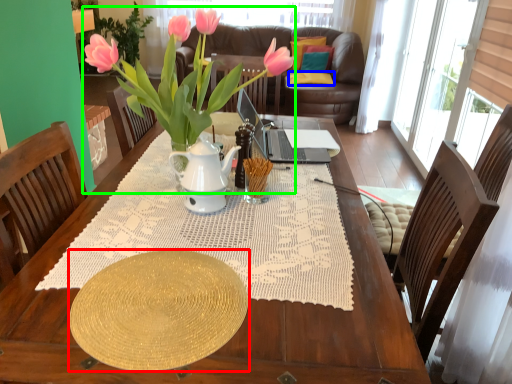
Question: Based on their relative distances, which object is farther from plate (highlighted by a red box)? Choose from pillow (highlighted by a blue box) and houseplant (highlighted by a green box).

Choices:
 (A) pillow
 (B) houseplant

Answer: (A)